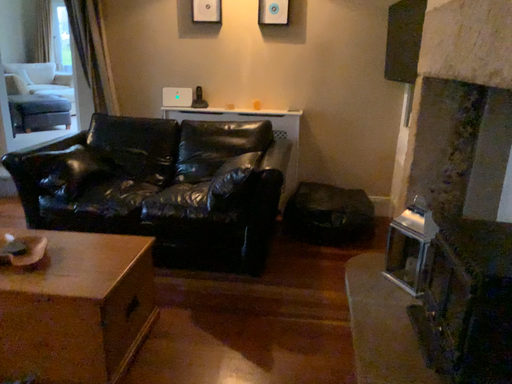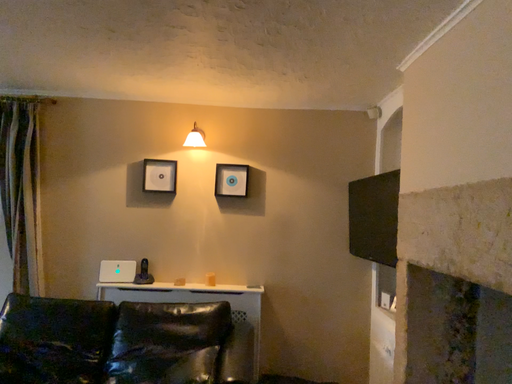
Question: Which way did the camera rotate in the video?

Choices:
 (A) rotated left
 (B) rotated right

Answer: (B)